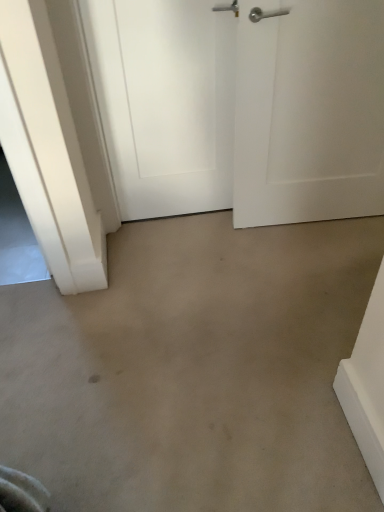
Where is `beige carpet at center`? This screenshot has height=512, width=384. beige carpet at center is located at coordinates (194, 370).

What do you see at coordinates (194, 370) in the screenshot? Image resolution: width=384 pixels, height=512 pixels. I see `beige carpet at center` at bounding box center [194, 370].

The height and width of the screenshot is (512, 384). What are the coordinates of `beige carpet at center` in the screenshot? It's located at (194, 370).